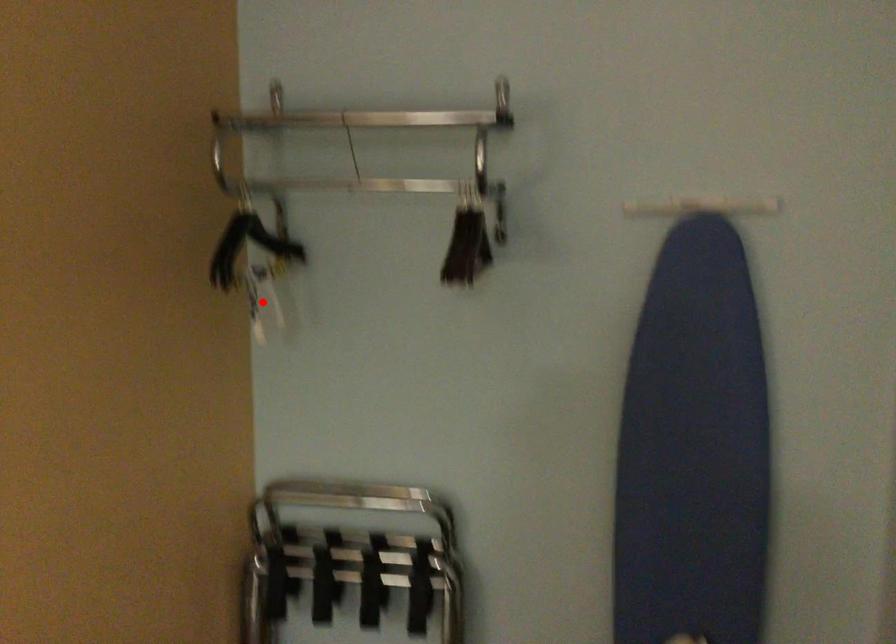
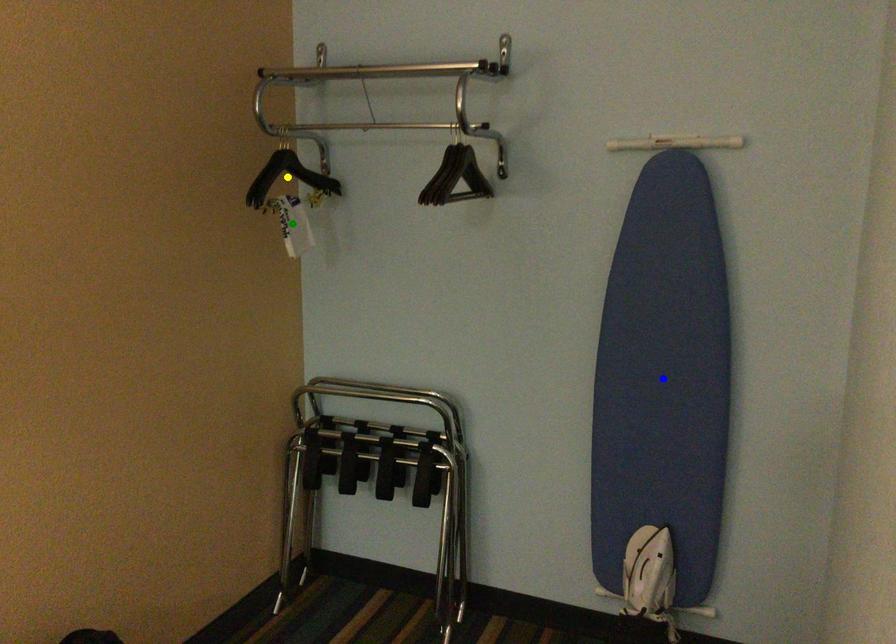
Question: I am providing you with two images of the same scene from different viewpoints. A red point is marked on the first image. You are given multiple points on the second image. In image 2, which mark is for the same physical point as the one in image 1?

Choices:
 (A) blue point
 (B) yellow point
 (C) green point

Answer: (C)